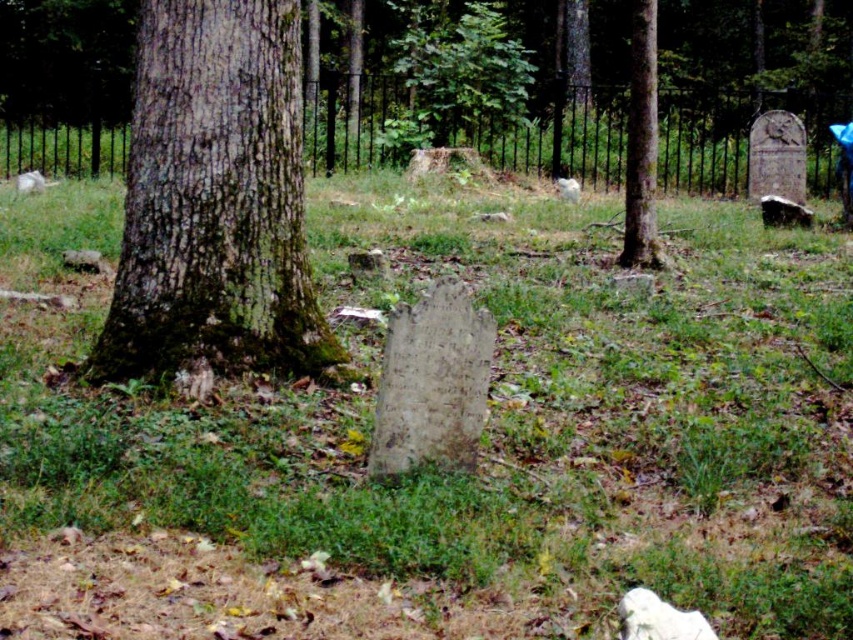
You are standing at the center of the cemetery and see the point marked at coordinates (x=213, y=200). What object is located at that point?

The point at coordinates (x=213, y=200) marks the green mossy bark tree at left.

You are standing at the point labeled point (183,301) and want to walk to the point labeled point (630,108). Which direction should you move to get closer to your destination?

You should move towards the upper left direction to reach point (630,108) from point (183,301).